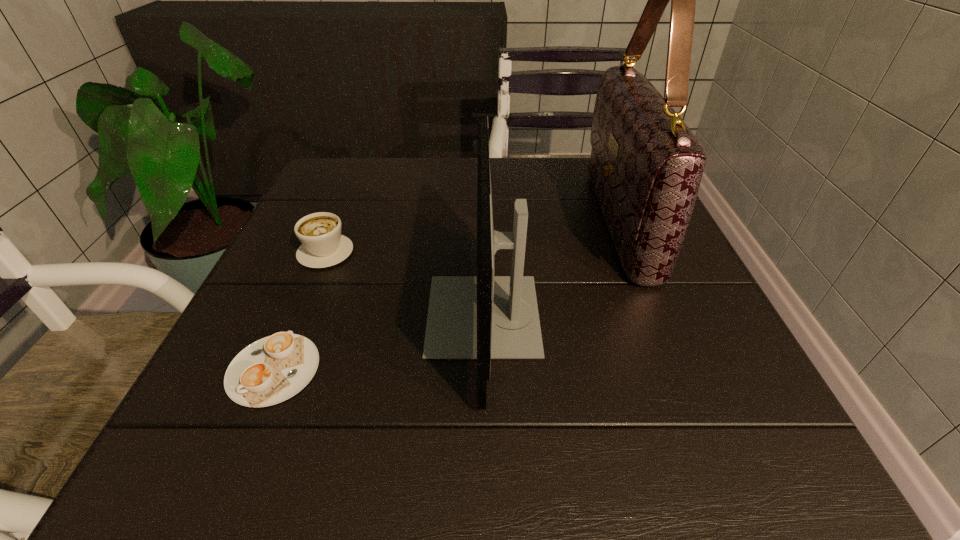
Identify the location of free space between the computer monitor and the shorter cappuccino. The width and height of the screenshot is (960, 540). (378, 342).

The width and height of the screenshot is (960, 540). Find the location of `blank region between the second object from right to left and the shortest object`. blank region between the second object from right to left and the shortest object is located at coordinates (378, 342).

The width and height of the screenshot is (960, 540). What are the coordinates of `vacant space that's between the computer monitor and the taller cappuccino` in the screenshot? It's located at (404, 284).

You are a GUI agent. You are given a task and a screenshot of the screen. Output one action in this format:
    pyautogui.click(x=<x>, y=<y>)
    Task: Click on the vacant region between the handbag and the taller cappuccino
    The image size is (960, 540).
    Given the screenshot: What is the action you would take?
    pyautogui.click(x=472, y=237)

In order to click on free space between the nearer cappuccino and the second tallest object in this screenshot , I will do `click(378, 342)`.

The height and width of the screenshot is (540, 960). I want to click on vacant area between the computer monitor and the third tallest object, so click(x=404, y=284).

You are a GUI agent. You are given a task and a screenshot of the screen. Output one action in this format:
    pyautogui.click(x=<x>, y=<y>)
    Task: Click on the vacant area that lies between the second shortest object and the tallest object
    This screenshot has width=960, height=540.
    Given the screenshot: What is the action you would take?
    pyautogui.click(x=472, y=237)

At what (x,y) coordinates should I click in order to perform the action: click on empty space that is in between the farther cappuccino and the nearer cappuccino. Please return your answer as a coordinate pair (x, y). The image size is (960, 540). Looking at the image, I should click on (300, 310).

Select which object appears as the third closest to the taller cappuccino. Please provide its 2D coordinates. Your answer should be formatted as a tuple, i.e. [(x, y)], where the tuple contains the x and y coordinates of a point satisfying the conditions above.

[(646, 165)]

Identify which object is the second nearest to the farther cappuccino. Please provide its 2D coordinates. Your answer should be formatted as a tuple, i.e. [(x, y)], where the tuple contains the x and y coordinates of a point satisfying the conditions above.

[(483, 317)]